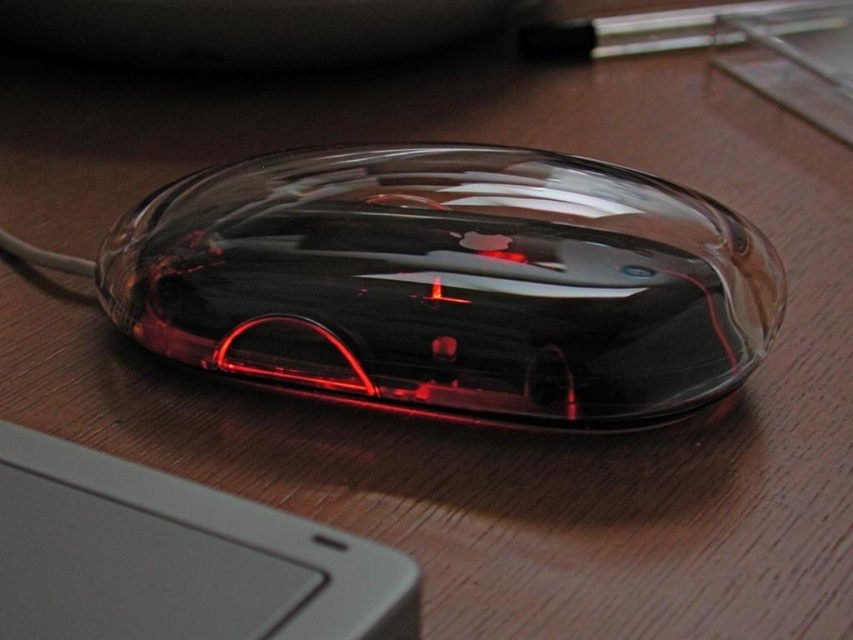
You are setting up your home office and want to place both the transparent plastic mouse at center and the gray matte keyboard at lower left on your desk. Given their sizes, which object will require more space on the desk?

The transparent plastic mouse at center requires more space on the desk because it is bigger than the gray matte keyboard at lower left.